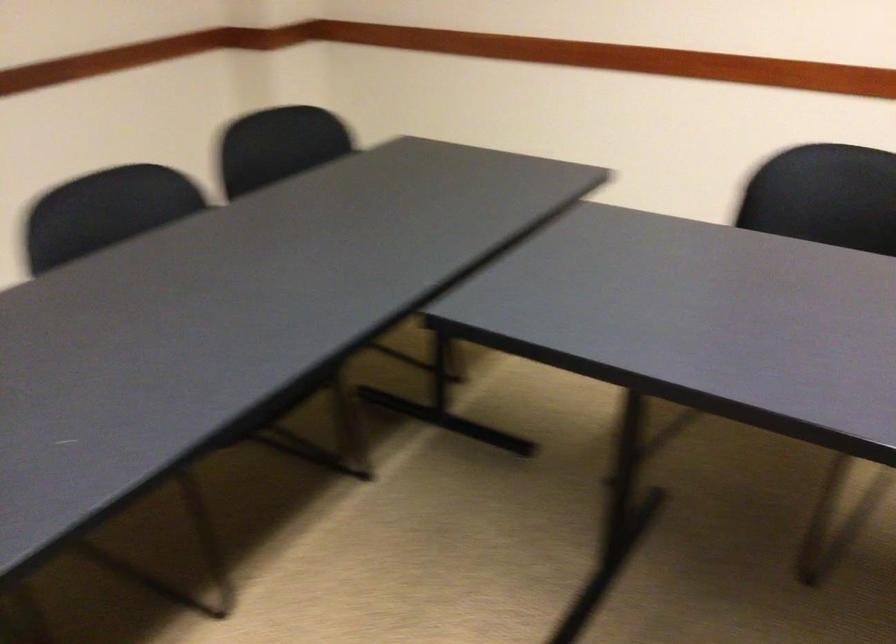
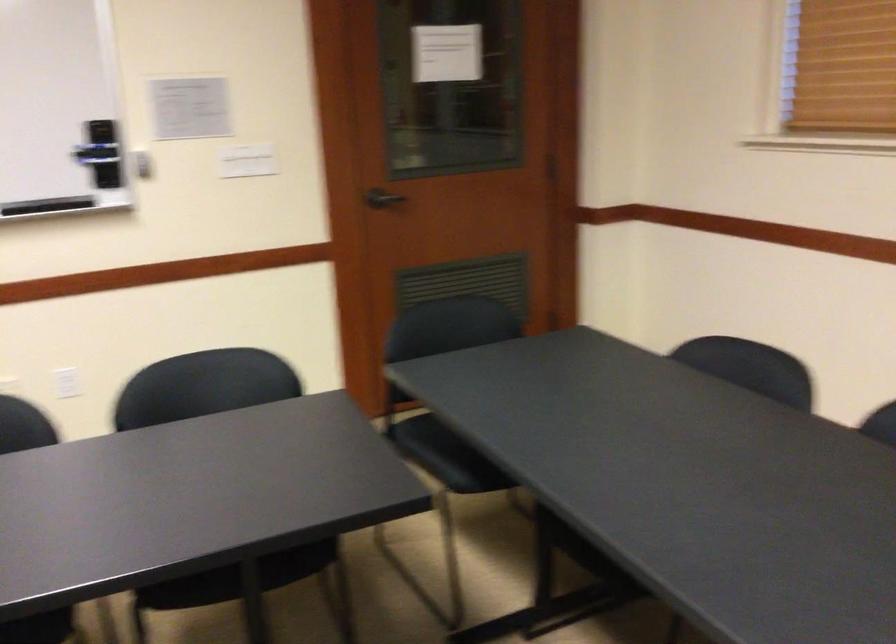
The images are taken continuously from a first-person perspective. In which direction is your viewpoint rotating?

The camera's rotation is toward left-down.